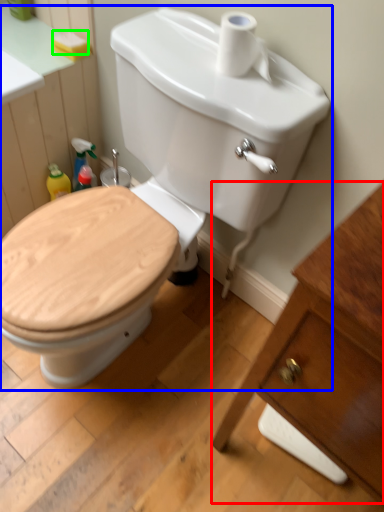
Question: Which object is positioned closest to porcelain (highlighted by a red box)? Select from toilet (highlighted by a blue box) and soap (highlighted by a green box).

Choices:
 (A) toilet
 (B) soap

Answer: (A)